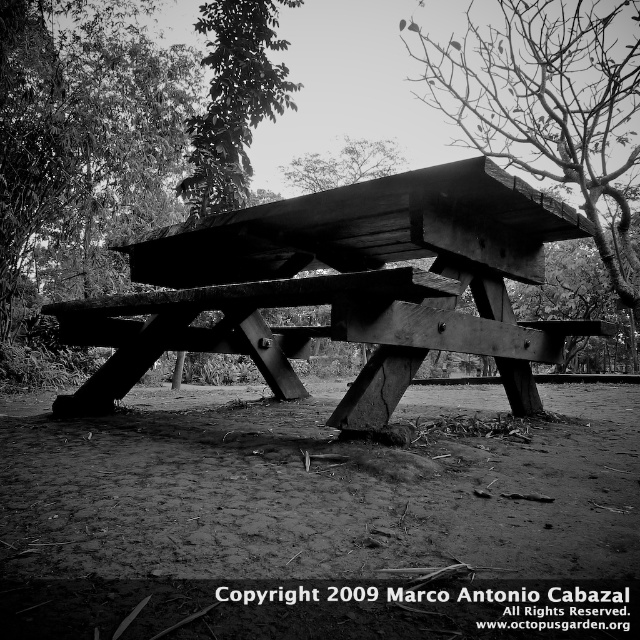
Question: Is bare wood tree at upper center to the left of green leafy tree at upper center from the viewer's perspective?

Choices:
 (A) yes
 (B) no

Answer: (B)

Question: Among these objects, which one is nearest to the camera?

Choices:
 (A) dirt/dry soil at lower center
 (B) bare wood tree at upper center
 (C) green leafy tree at upper center

Answer: (A)

Question: Does dirt/dry soil at lower center lie in front of bare wood tree at upper center?

Choices:
 (A) no
 (B) yes

Answer: (B)

Question: Can you confirm if dirt/dry soil at lower center is bigger than green leafy tree at upper center?

Choices:
 (A) no
 (B) yes

Answer: (A)

Question: Which object is farther from the camera taking this photo?

Choices:
 (A) bare wood tree at upper center
 (B) dirt/dry soil at lower center

Answer: (A)

Question: Which object is the farthest from the wooden picnic table at center?

Choices:
 (A) green leafy tree at upper center
 (B) bare wood tree at upper center
 (C) dirt/dry soil at lower center

Answer: (B)